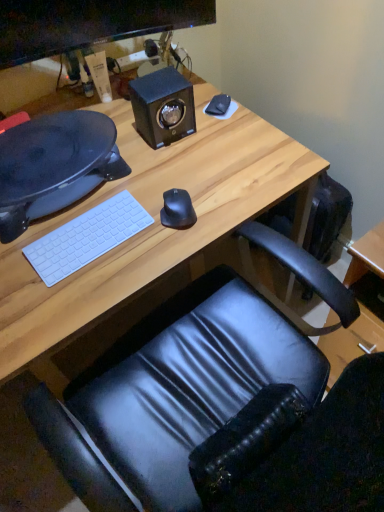
Find the location of a particular element. Image resolution: width=384 pixels, height=512 pixels. free location to the left of black textured speaker at upper center is located at coordinates point(123,133).